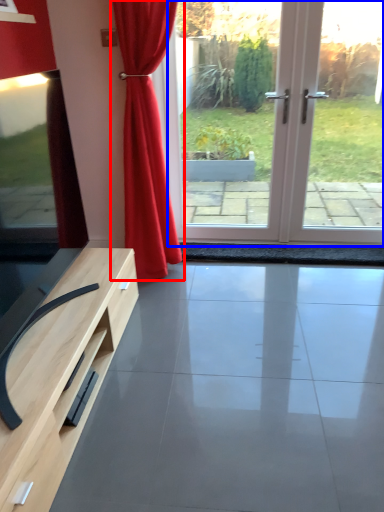
Question: Which point is further to the camera, curtain (highlighted by a red box) or screen door (highlighted by a blue box)?

Choices:
 (A) curtain
 (B) screen door

Answer: (B)